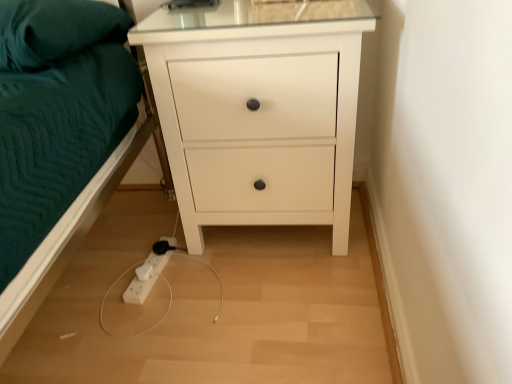
This screenshot has width=512, height=384. Identify the location of teal fabric pillow at upper left. (55, 30).

What do you see at coordinates (55, 30) in the screenshot? The height and width of the screenshot is (384, 512). I see `teal fabric pillow at upper left` at bounding box center [55, 30].

In order to face white matte chest of drawers at center, should I rotate leftwards or rightwards?

A 1.174 degree turn to the right will do.

Identify the location of white matte chest of drawers at center. (259, 111).

Describe the element at coordinates (259, 111) in the screenshot. The height and width of the screenshot is (384, 512). I see `white matte chest of drawers at center` at that location.

This screenshot has width=512, height=384. In order to click on teal fabric pillow at upper left in this screenshot , I will do `click(55, 30)`.

Considering the relative positions of white matte chest of drawers at center and teal fabric pillow at upper left in the image provided, is white matte chest of drawers at center to the left of teal fabric pillow at upper left from the viewer's perspective?

In fact, white matte chest of drawers at center is to the right of teal fabric pillow at upper left.

Does white matte chest of drawers at center lie in front of teal fabric pillow at upper left?

No.

Which point is more forward, (292,124) or (82,24)?

Point (82,24)

From the image's perspective, is white matte chest of drawers at center positioned above or below teal fabric pillow at upper left?

Clearly, from the image's perspective, white matte chest of drawers at center is below teal fabric pillow at upper left.

From a real-world perspective, is white matte chest of drawers at center under teal fabric pillow at upper left?

Correct, in the physical world, white matte chest of drawers at center is lower than teal fabric pillow at upper left.

Which object is thinner, white matte chest of drawers at center or teal fabric pillow at upper left?

white matte chest of drawers at center.

Between white matte chest of drawers at center and teal fabric pillow at upper left, which one has more height?

white matte chest of drawers at center is taller.

Based on their sizes in the image, would you say white matte chest of drawers at center is bigger or smaller than teal fabric pillow at upper left?

Considering their sizes, white matte chest of drawers at center takes up more space than teal fabric pillow at upper left.

Is white matte chest of drawers at center located outside teal fabric pillow at upper left?

white matte chest of drawers at center lies outside teal fabric pillow at upper left's area.

Does white matte chest of drawers at center touch teal fabric pillow at upper left?

There is a gap between white matte chest of drawers at center and teal fabric pillow at upper left.

Is white matte chest of drawers at center looking in the opposite direction of teal fabric pillow at upper left?

No, teal fabric pillow at upper left is not at the back of white matte chest of drawers at center.

What's the angular difference between white matte chest of drawers at center and teal fabric pillow at upper left's facing directions?

The angular difference between white matte chest of drawers at center and teal fabric pillow at upper left is 5.99 degrees.

Where is `pillow in front of the white matte chest of drawers at center`? This screenshot has width=512, height=384. pillow in front of the white matte chest of drawers at center is located at coordinates (55, 30).

Considering the positions of objects teal fabric pillow at upper left and white matte chest of drawers at center in the image provided, who is more to the left, teal fabric pillow at upper left or white matte chest of drawers at center?

teal fabric pillow at upper left is more to the left.

Which object is more forward, teal fabric pillow at upper left or white matte chest of drawers at center?

Positioned in front is teal fabric pillow at upper left.

Does point (125, 40) come farther from viewer compared to point (302, 207)?

No, it is in front of (302, 207).

From the image's perspective, which is below, teal fabric pillow at upper left or white matte chest of drawers at center?

white matte chest of drawers at center.

From a real-world perspective, is teal fabric pillow at upper left above or below white matte chest of drawers at center?

Clearly, from a real-world perspective, teal fabric pillow at upper left is above white matte chest of drawers at center.

In terms of width, does teal fabric pillow at upper left look wider or thinner when compared to white matte chest of drawers at center?

Clearly, teal fabric pillow at upper left has more width compared to white matte chest of drawers at center.

Who is taller, teal fabric pillow at upper left or white matte chest of drawers at center?

white matte chest of drawers at center.

Considering the sizes of objects teal fabric pillow at upper left and white matte chest of drawers at center in the image provided, who is bigger, teal fabric pillow at upper left or white matte chest of drawers at center?

white matte chest of drawers at center.

Based on the photo, is teal fabric pillow at upper left not inside white matte chest of drawers at center?

Yes, teal fabric pillow at upper left is outside of white matte chest of drawers at center.

Is teal fabric pillow at upper left far away from white matte chest of drawers at center?

teal fabric pillow at upper left is actually quite close to white matte chest of drawers at center.

In the scene shown: Is teal fabric pillow at upper left aimed at white matte chest of drawers at center?

No.

Locate an element on the screen. the chest of drawers located underneath the teal fabric pillow at upper left (from a real-world perspective) is located at coordinates (259, 111).

The width and height of the screenshot is (512, 384). What are the coordinates of `chest of drawers to the right of teal fabric pillow at upper left` in the screenshot? It's located at (259, 111).

You are a GUI agent. You are given a task and a screenshot of the screen. Output one action in this format:
    pyautogui.click(x=<x>, y=<y>)
    Task: Click on the chest of drawers below the teal fabric pillow at upper left (from the image's perspective)
    This screenshot has height=384, width=512.
    Given the screenshot: What is the action you would take?
    pyautogui.click(x=259, y=111)